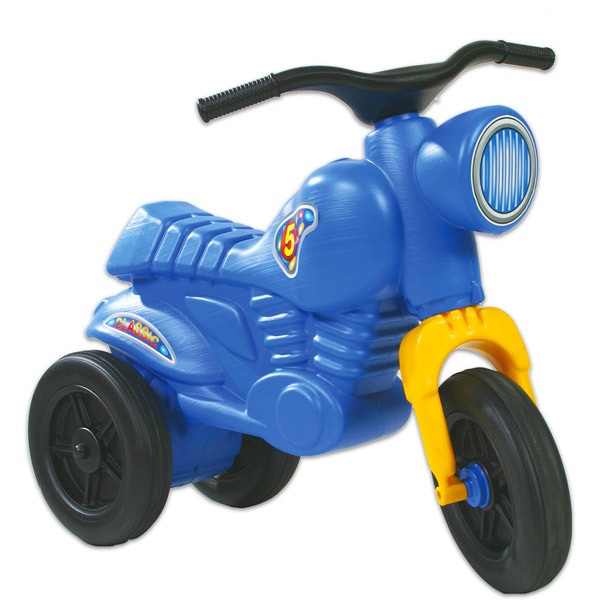
Locate an element on the screen. This screenshot has height=600, width=600. seat is located at coordinates (205, 229).